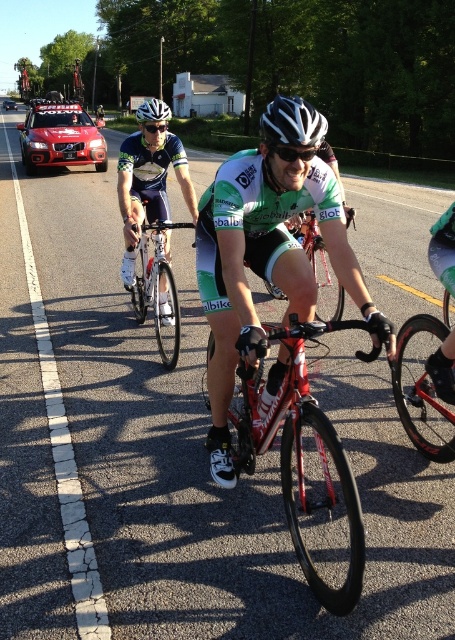
Question: Which object appears closest to the camera in this image?

Choices:
 (A) white matte bicycle helmet at upper center
 (B) green matte cycling jersey at center

Answer: (B)

Question: Can you confirm if green matte cycling jersey at center is wider than shiny black frame at center?

Choices:
 (A) no
 (B) yes

Answer: (B)

Question: Is shiny black frame at center positioned behind matte red car at upper left?

Choices:
 (A) yes
 (B) no

Answer: (B)

Question: Among these points, which one is nearest to the camera?

Choices:
 (A) (127, 156)
 (B) (328, 273)

Answer: (A)

Question: Does shiny red bike at center have a smaller size compared to shiny red bicycle at center?

Choices:
 (A) no
 (B) yes

Answer: (A)

Question: Which object appears farthest from the camera in this image?

Choices:
 (A) shiny red bike at center
 (B) shiny red bicycle at center

Answer: (B)